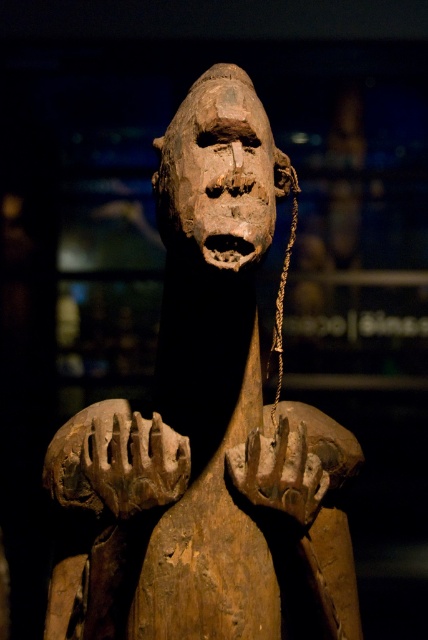
Who is more forward, (219, 584) or (183, 120)?

Point (183, 120) is more forward.

Is wooden statue at center taller than wooden mask at center?

Yes, wooden statue at center is taller than wooden mask at center.

Between point (240, 88) and point (237, 237), which one is positioned behind?

The point (240, 88) is more distant.

Identify the location of wooden statue at center. (207, 428).